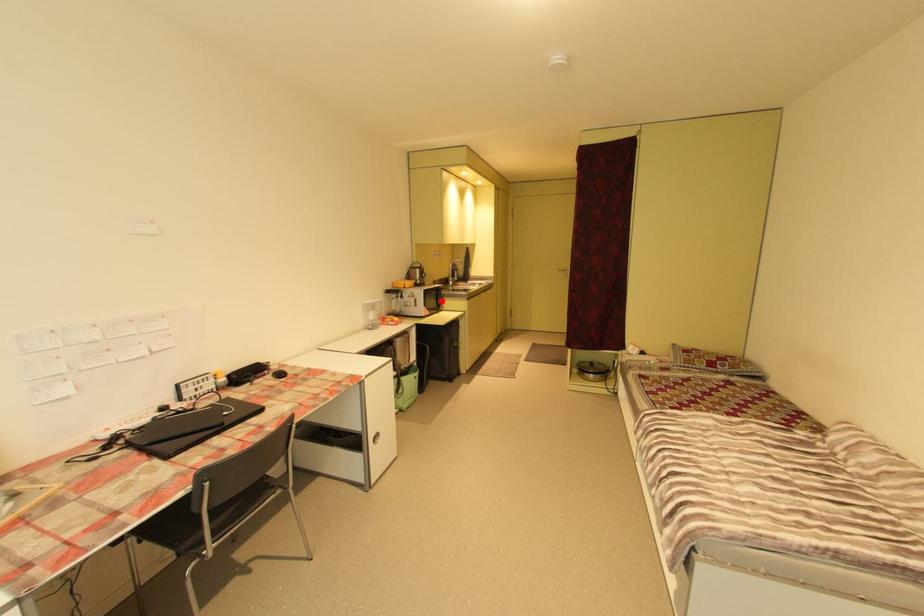
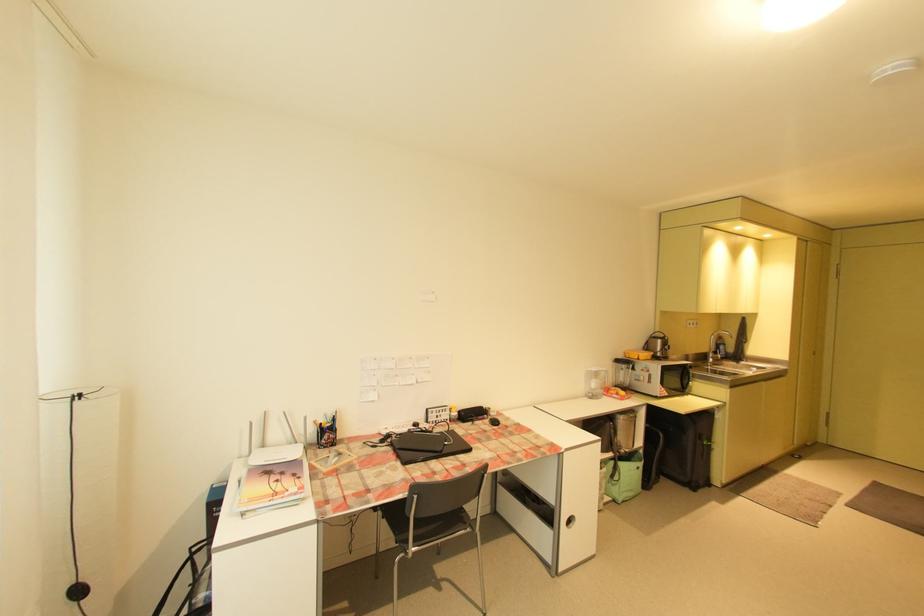
Question: A red point is marked in image1. In image2, is the corresponding 3D point closer to the camera or farther? Reply with the corresponding letter.

Choices:
 (A) The corresponding 3D point is closer.
 (B) The corresponding 3D point is farther.

Answer: (B)